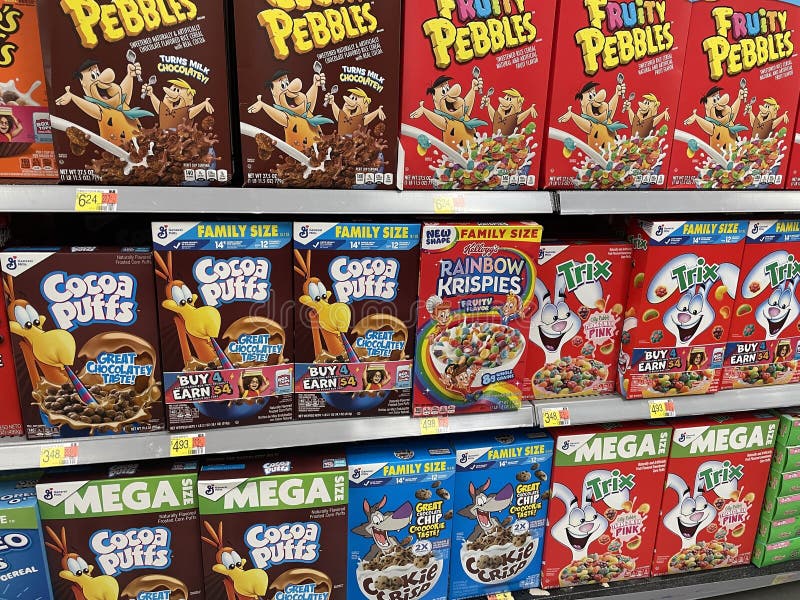
Image resolution: width=800 pixels, height=600 pixels. What are the coordinates of `brown box` in the screenshot? It's located at (144, 532), (272, 549), (270, 350), (92, 367), (362, 336), (294, 69), (172, 94).